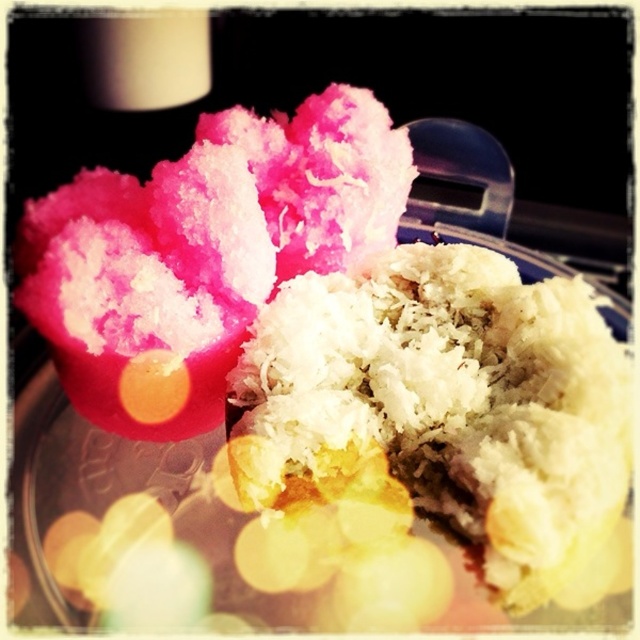
You are designing a food platter and want to place the white shredded rice at center and the pink fluffy cotton candy at upper left. Given their sizes, which one should you place first to ensure they fit properly on the plate?

The white shredded rice at center has a smaller width than the pink fluffy cotton candy at upper left, so you should place the pink fluffy cotton candy at upper left first to account for its larger size and ensure proper spacing on the plate.

You are a food stylist arranging a dessert platter. You have a glass plate with the white shredded rice at center and the pink fluffy cotton candy at upper left. Since space is limited, which item takes up more area on the plate?

The pink fluffy cotton candy at upper left occupies more space than the white shredded rice at center.

You are a food stylist arranging a dessert display. You need to place a small chocolate figurine between the white shredded rice at center and the pink fluffy cotton candy at upper left. Based on their heights, which object should the figurine be placed closer to?

The white shredded rice at center is not as tall as the pink fluffy cotton candy at upper left, so the chocolate figurine should be placed closer to the taller pink fluffy cotton candy at upper left to maintain visual balance.